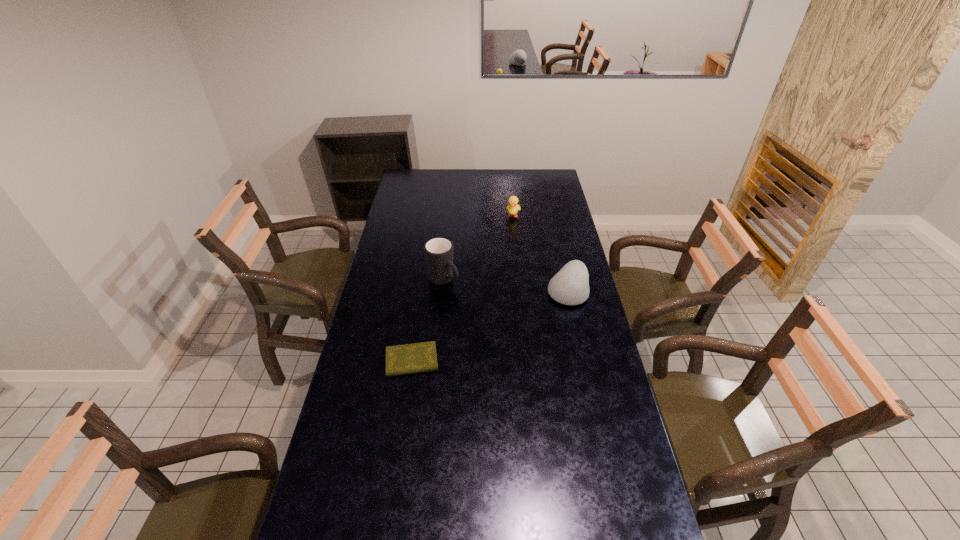
Where is `empty space between the third object from left to right and the nearest object`? empty space between the third object from left to right and the nearest object is located at coordinates (463, 288).

At what (x,y) coordinates should I click in order to perform the action: click on unoccupied position between the duckling and the mug. Please return your answer as a coordinate pair (x, y). The height and width of the screenshot is (540, 960). Looking at the image, I should click on (478, 248).

Find the location of a particular element. This screenshot has height=540, width=960. blank region between the nearest object and the rightmost object is located at coordinates (490, 326).

Identify the location of unoccupied position between the shortest object and the beanie. This screenshot has height=540, width=960. (490, 326).

Where is `free point between the tallest object and the beanie`? This screenshot has height=540, width=960. free point between the tallest object and the beanie is located at coordinates (505, 286).

Locate an element on the screen. This screenshot has width=960, height=540. free space that is in between the diary and the mug is located at coordinates (427, 321).

At what (x,y) coordinates should I click in order to perform the action: click on unoccupied position between the farthest object and the beanie. Please return your answer as a coordinate pair (x, y). The width and height of the screenshot is (960, 540). Looking at the image, I should click on (540, 253).

You are a GUI agent. You are given a task and a screenshot of the screen. Output one action in this format:
    pyautogui.click(x=<x>, y=<y>)
    Task: Click on the free space between the beanie and the mug
    The height and width of the screenshot is (540, 960).
    Given the screenshot: What is the action you would take?
    pyautogui.click(x=505, y=286)

Where is `free space between the diary and the mug`? The image size is (960, 540). free space between the diary and the mug is located at coordinates (427, 321).

Locate an element on the screen. vacant space that is in between the tallest object and the shortest object is located at coordinates (427, 321).